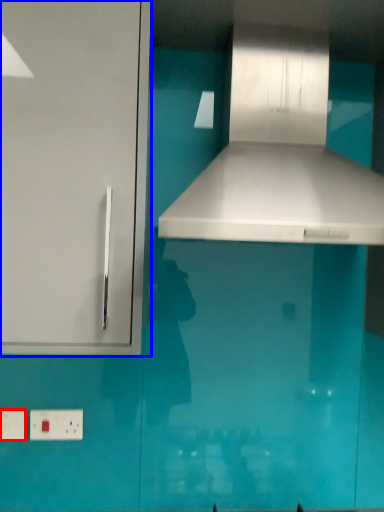
Question: Among these objects, which one is farthest to the camera, electric outlet (highlighted by a red box) or cabinetry (highlighted by a blue box)?

Choices:
 (A) electric outlet
 (B) cabinetry

Answer: (A)